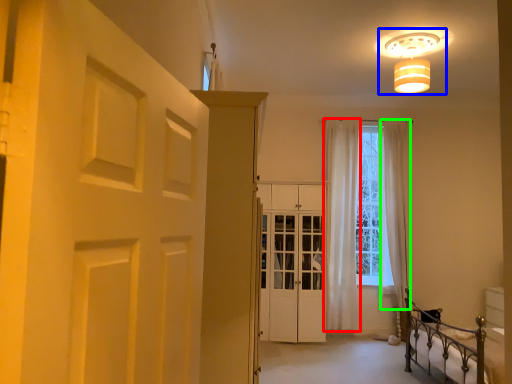
Question: Which object is the closest to the curtain (highlighted by a red box)? Choose among these: lamp (highlighted by a blue box) or curtain (highlighted by a green box).

Choices:
 (A) lamp
 (B) curtain

Answer: (B)